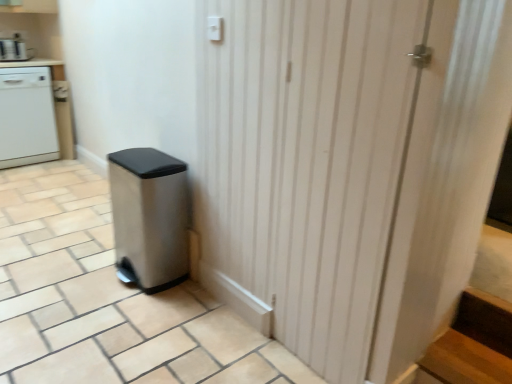
The image size is (512, 384). Identify the location of free space in front of white wood screen door at center. (254, 360).